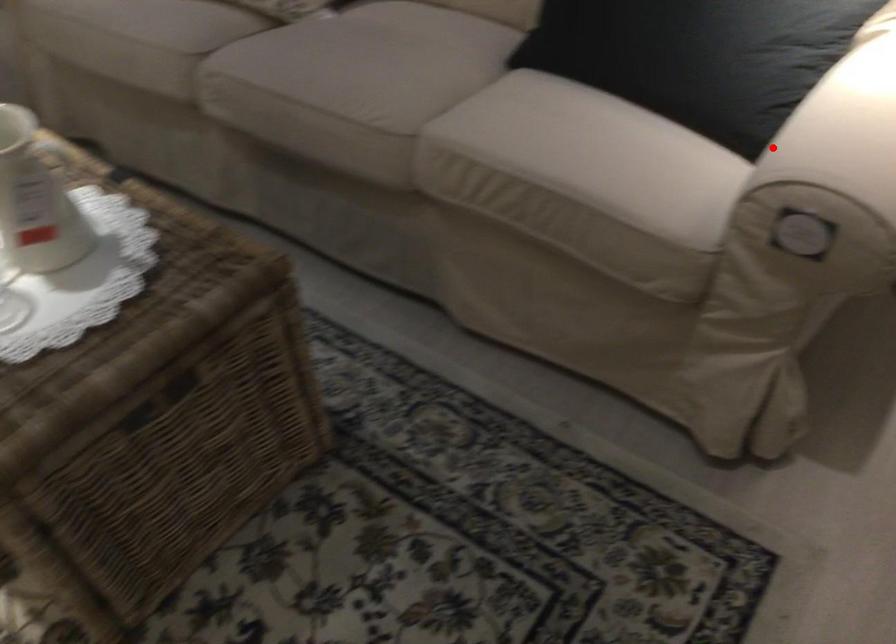
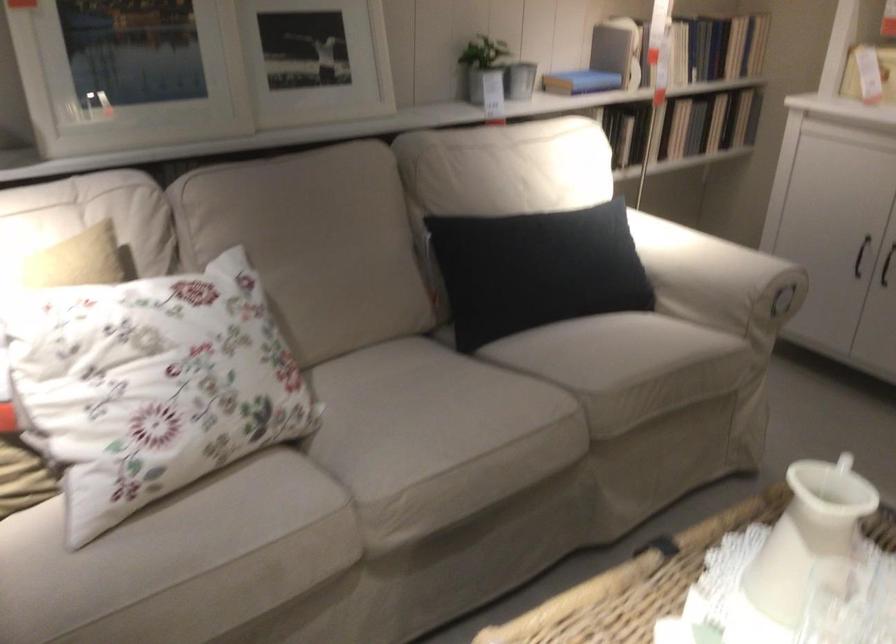
Question: I am providing you with two images of the same scene from different viewpoints. A red point is shown in image1. For the corresponding object point in image2, is it positioned nearer or farther from the camera?

Choices:
 (A) Nearer
 (B) Farther

Answer: (B)